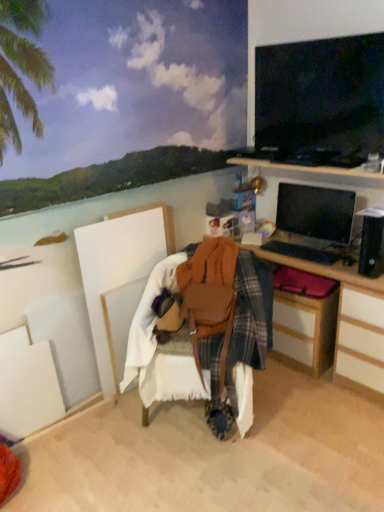
Question: From a real-world perspective, is matte black monitor at right under wooden desk at center?

Choices:
 (A) no
 (B) yes

Answer: (A)

Question: Is matte black monitor at right placed right next to wooden desk at center?

Choices:
 (A) yes
 (B) no

Answer: (B)

Question: Can you confirm if matte black monitor at right is positioned to the right of wooden desk at center?

Choices:
 (A) yes
 (B) no

Answer: (A)

Question: Considering the relative sizes of matte black monitor at right and wooden desk at center in the image provided, is matte black monitor at right taller than wooden desk at center?

Choices:
 (A) no
 (B) yes

Answer: (A)

Question: Considering the relative sizes of matte black monitor at right and wooden desk at center in the image provided, is matte black monitor at right smaller than wooden desk at center?

Choices:
 (A) no
 (B) yes

Answer: (B)

Question: From the image's perspective, is wooden desk at center above or below plaid fabric drawer at right?

Choices:
 (A) above
 (B) below

Answer: (A)

Question: From a real-world perspective, is wooden desk at center positioned above or below plaid fabric drawer at right?

Choices:
 (A) below
 (B) above

Answer: (B)

Question: Is point (359, 355) positioned closer to the camera than point (331, 324)?

Choices:
 (A) closer
 (B) farther

Answer: (A)

Question: Considering the positions of wooden desk at center and plaid fabric drawer at right in the image, is wooden desk at center bigger or smaller than plaid fabric drawer at right?

Choices:
 (A) big
 (B) small

Answer: (A)

Question: Is plaid fabric drawer at right wider or thinner than leather at center?

Choices:
 (A) wide
 (B) thin

Answer: (B)

Question: Is plaid fabric drawer at right situated inside leather at center or outside?

Choices:
 (A) inside
 (B) outside

Answer: (B)

Question: Looking at the image, does plaid fabric drawer at right seem bigger or smaller compared to leather at center?

Choices:
 (A) small
 (B) big

Answer: (A)

Question: Relative to leather at center, is plaid fabric drawer at right in front or behind?

Choices:
 (A) behind
 (B) front

Answer: (A)

Question: Is wooden desk at center wider or thinner than matte black monitor at right?

Choices:
 (A) thin
 (B) wide

Answer: (B)

Question: Is point (369, 373) closer or farther from the camera than point (319, 210)?

Choices:
 (A) farther
 (B) closer

Answer: (B)